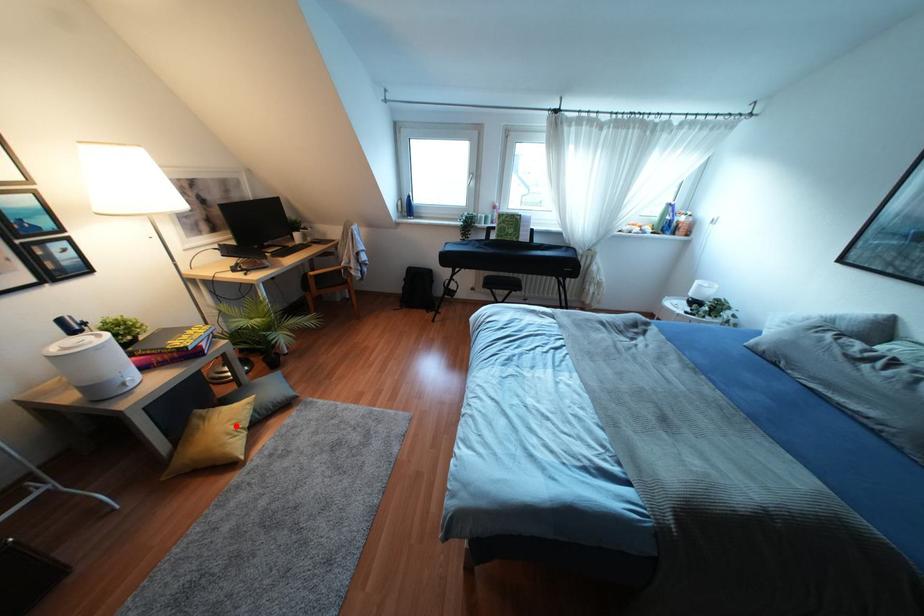
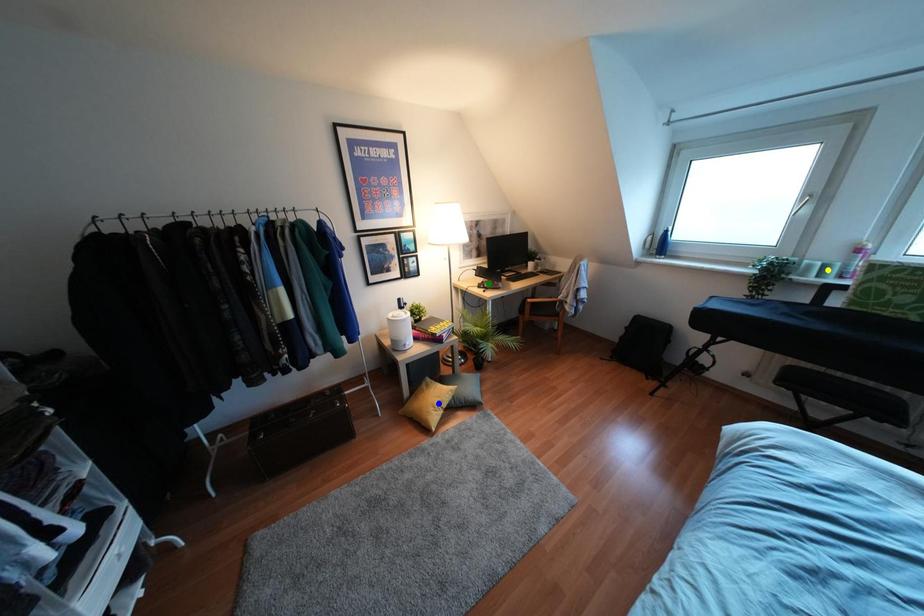
Question: I am providing you with two images of the same scene from different viewpoints. A red point is marked on the first image. You are given multiple points on the second image. Which point in image 2 is actually the same real-world point as the red point in image 1?

Choices:
 (A) green point
 (B) yellow point
 (C) blue point

Answer: (C)